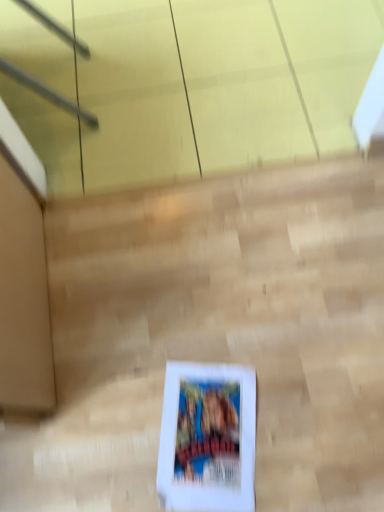
You are a GUI agent. You are given a task and a screenshot of the screen. Output one action in this format:
    pyautogui.click(x=<x>, y=<y>)
    Task: Click on the vacant location below white paper at center (from a real-world perspective)
    The width and height of the screenshot is (384, 512).
    Given the screenshot: What is the action you would take?
    coord(211,438)